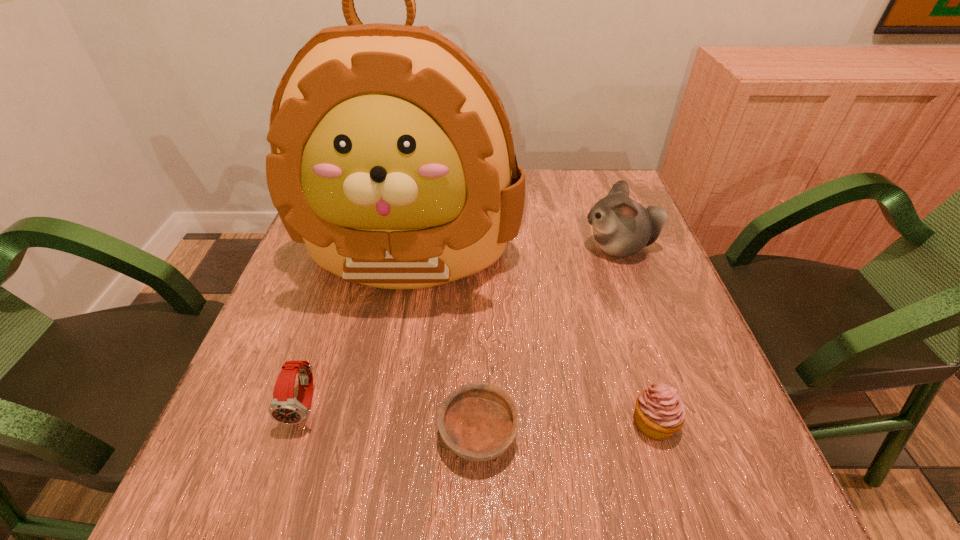
Image resolution: width=960 pixels, height=540 pixels. Find the location of `vacant region between the fourth shortest object and the watch`. vacant region between the fourth shortest object and the watch is located at coordinates (462, 326).

Locate an element on the screen. blank region between the watch and the bowl is located at coordinates (392, 420).

Locate an element on the screen. The height and width of the screenshot is (540, 960). free spot between the cupcake and the backpack is located at coordinates (532, 337).

The width and height of the screenshot is (960, 540). In order to click on empty location between the bowl and the second tallest object in this screenshot , I will do `click(549, 340)`.

This screenshot has height=540, width=960. I want to click on vacant area that lies between the backpack and the bowl, so click(444, 342).

This screenshot has width=960, height=540. Identify the location of object that is the fourth closest to the bowl. (622, 227).

Select which object appears as the third closest to the bowl. Please provide its 2D coordinates. Your answer should be formatted as a tuple, i.e. [(x, y)], where the tuple contains the x and y coordinates of a point satisfying the conditions above.

[(284, 408)]

Locate an element on the screen. free space that satisfies the following two spatial constraints: 1. on the front-facing side of the bowl; 2. on the left side of the backpack is located at coordinates (376, 434).

This screenshot has width=960, height=540. Identify the location of vacant area in the image that satisfies the following two spatial constraints: 1. on the face of the watch; 2. on the left side of the bowl. (296, 434).

You are a GUI agent. You are given a task and a screenshot of the screen. Output one action in this format:
    pyautogui.click(x=<x>, y=<y>)
    Task: Click on the vacant space that satisfies the following two spatial constraints: 1. on the face of the watch; 2. on the left side of the bowl
    The image size is (960, 540).
    Given the screenshot: What is the action you would take?
    pyautogui.click(x=296, y=434)